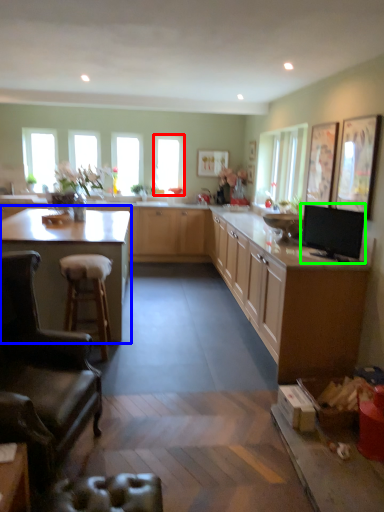
Question: Considering the real-world distances, which object is closest to window (highlighted by a red box)? countertop (highlighted by a blue box) or appliance (highlighted by a green box).

Choices:
 (A) countertop
 (B) appliance

Answer: (A)